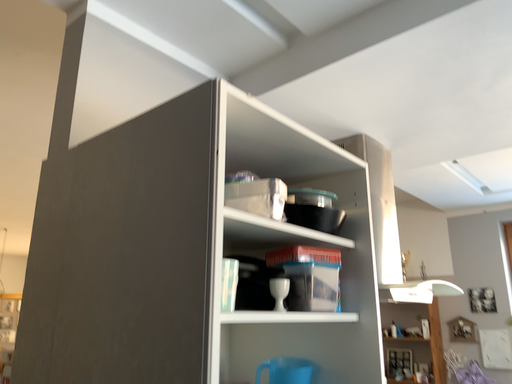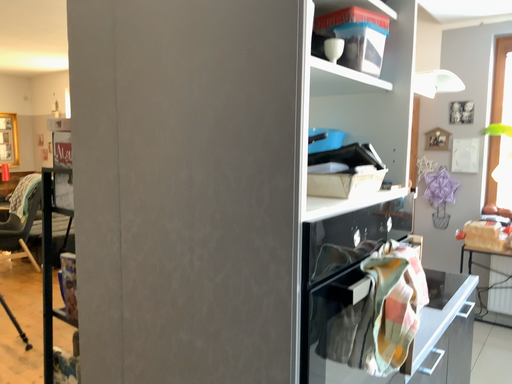
Question: Which way did the camera rotate in the video?

Choices:
 (A) rotated downward
 (B) rotated upward

Answer: (A)